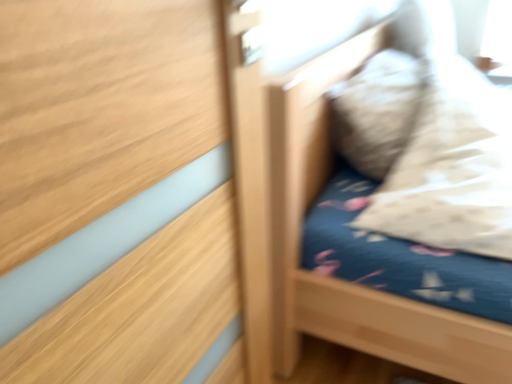
What is the approximate width of white soft pillow at upper right?

The width of white soft pillow at upper right is 21.66 centimeters.

I want to click on white soft pillow at upper right, so click(x=376, y=111).

What do you see at coordinates (376, 111) in the screenshot? Image resolution: width=512 pixels, height=384 pixels. I see `white soft pillow at upper right` at bounding box center [376, 111].

Locate an element on the screen. white soft pillow at upper right is located at coordinates (376, 111).